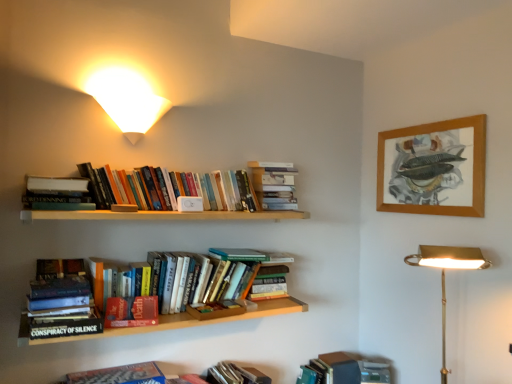
Question: From the image's perspective, is gold brass desk lamp at lower right, which is counted as the first lamp, starting from the right, below hardcover book at upper left, which ranks as the third book in top-to-bottom order?

Choices:
 (A) no
 (B) yes

Answer: (B)

Question: Are gold brass desk lamp at lower right, the second lamp when ordered from top to bottom, and hardcover book at upper left, which ranks as the third book in top-to-bottom order, far apart?

Choices:
 (A) no
 (B) yes

Answer: (B)

Question: Is the position of gold brass desk lamp at lower right, acting as the first lamp starting from the bottom, less distant than that of hardcover book at upper left, which ranks as the third book in top-to-bottom order?

Choices:
 (A) yes
 (B) no

Answer: (A)

Question: Does gold brass desk lamp at lower right, acting as the 2th lamp starting from the left, contain hardcover book at upper left, the 5th book ordered from the bottom?

Choices:
 (A) no
 (B) yes

Answer: (A)

Question: Considering the relative positions of gold brass desk lamp at lower right, the second lamp when ordered from top to bottom, and hardcover book at upper left, which ranks as the third book in top-to-bottom order, in the image provided, is gold brass desk lamp at lower right, the second lamp when ordered from top to bottom, to the left of hardcover book at upper left, which ranks as the third book in top-to-bottom order, from the viewer's perspective?

Choices:
 (A) yes
 (B) no

Answer: (B)

Question: From the image's perspective, is hardcover book at center, placed as the fifth book when sorted from top to bottom, above or below hardcover book at lower left, positioned as the fourth book in bottom-to-top order?

Choices:
 (A) below
 (B) above

Answer: (A)

Question: Is hardcover book at center, placed as the fifth book when sorted from top to bottom, wider or thinner than hardcover book at lower left, positioned as the fourth book in bottom-to-top order?

Choices:
 (A) wide
 (B) thin

Answer: (B)

Question: From their relative heights in the image, would you say hardcover book at center, the third book ordered from the bottom, is taller or shorter than hardcover book at lower left, positioned as the fourth book in bottom-to-top order?

Choices:
 (A) short
 (B) tall

Answer: (A)

Question: Considering their positions, is hardcover book at center, the third book ordered from the bottom, located in front of or behind hardcover book at lower left, positioned as the fourth book in bottom-to-top order?

Choices:
 (A) behind
 (B) front

Answer: (A)

Question: Considering the positions of white matte wall sconce at upper left, acting as the second lamp starting from the right, and gold brass desk lamp at lower right, acting as the 2th lamp starting from the left, in the image, is white matte wall sconce at upper left, acting as the second lamp starting from the right, bigger or smaller than gold brass desk lamp at lower right, acting as the 2th lamp starting from the left,?

Choices:
 (A) small
 (B) big

Answer: (A)

Question: Is white matte wall sconce at upper left, the second lamp ordered from the bottom, situated inside gold brass desk lamp at lower right, which is counted as the first lamp, starting from the right, or outside?

Choices:
 (A) inside
 (B) outside

Answer: (B)

Question: Would you say white matte wall sconce at upper left, the second lamp ordered from the bottom, is to the left or to the right of gold brass desk lamp at lower right, acting as the 2th lamp starting from the left, in the picture?

Choices:
 (A) right
 (B) left

Answer: (B)

Question: From the image's perspective, is white matte wall sconce at upper left, the second lamp ordered from the bottom, located above or below gold brass desk lamp at lower right, acting as the first lamp starting from the bottom?

Choices:
 (A) above
 (B) below

Answer: (A)

Question: Is hardcover book at upper left, the 5th book ordered from the bottom, situated inside hardcover book at center, the 6th book in the top-to-bottom sequence, or outside?

Choices:
 (A) inside
 (B) outside

Answer: (B)

Question: Looking at the image, does hardcover book at upper left, which ranks as the third book in top-to-bottom order, seem bigger or smaller compared to hardcover book at center, the 6th book in the top-to-bottom sequence?

Choices:
 (A) big
 (B) small

Answer: (A)